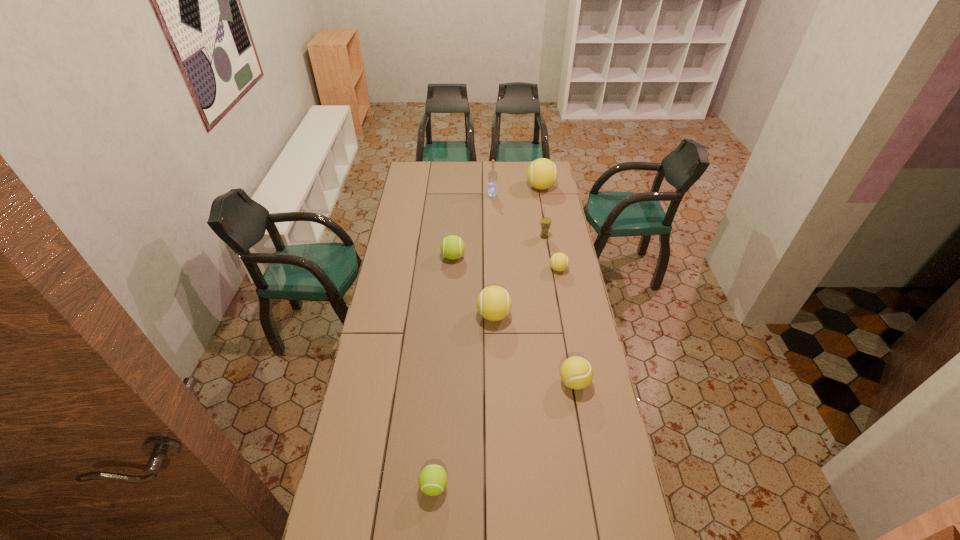
The height and width of the screenshot is (540, 960). I want to click on blue vodka, so click(x=492, y=175).

The width and height of the screenshot is (960, 540). Find the location of `the tallest object`. the tallest object is located at coordinates (492, 175).

Where is `the biggest yellow tennis ball`? the biggest yellow tennis ball is located at coordinates pyautogui.click(x=542, y=173).

This screenshot has width=960, height=540. I want to click on the farthest tennis ball, so (x=542, y=173).

Image resolution: width=960 pixels, height=540 pixels. Identify the location of yellow straw for drinking. (545, 222).

Identify the location of the third farthest object. (545, 222).

You are a GUI agent. You are given a task and a screenshot of the screen. Output one action in this format:
    pyautogui.click(x=<x>, y=<y>)
    Task: Click on the third tennis ball from left to right
    
    Given the screenshot: What is the action you would take?
    pyautogui.click(x=494, y=303)

Locate an element on the screen. The width and height of the screenshot is (960, 540). the sixth farthest object is located at coordinates (494, 303).

Where is `the bigger green tennis ball`? The image size is (960, 540). the bigger green tennis ball is located at coordinates click(x=452, y=247).

At what (x,y) coordinates should I click in order to perform the action: click on the second smallest yellow tennis ball. Please return your answer as a coordinate pair (x, y). This screenshot has height=540, width=960. Looking at the image, I should click on (576, 372).